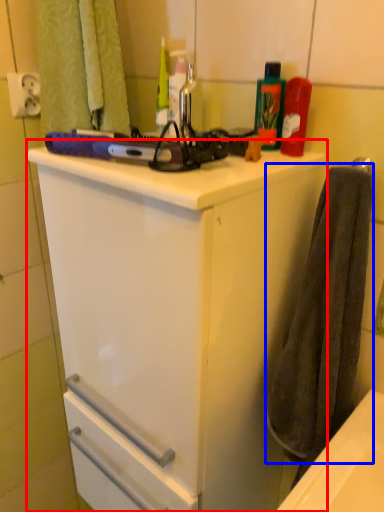
Question: Which of the following is the farthest to the observer, bathroom cabinet (highlighted by a red box) or bath towel (highlighted by a blue box)?

Choices:
 (A) bathroom cabinet
 (B) bath towel

Answer: (B)